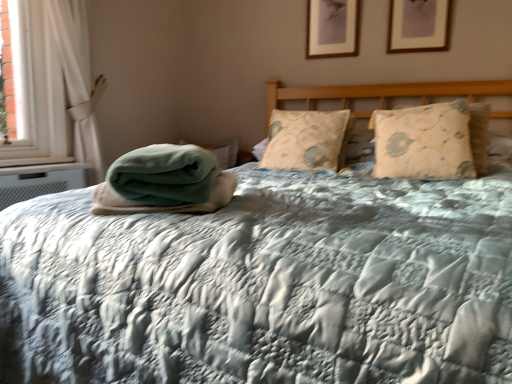
What do you see at coordinates (418, 25) in the screenshot? This screenshot has height=384, width=512. I see `wooden picture frame at upper center, arranged as the 2th picture frame when viewed from the left` at bounding box center [418, 25].

This screenshot has height=384, width=512. Describe the element at coordinates (332, 28) in the screenshot. I see `matte wooden picture frame at upper center, the first picture frame in the back-to-front sequence` at that location.

Image resolution: width=512 pixels, height=384 pixels. What do you see at coordinates (306, 140) in the screenshot?
I see `beige floral pillow at center, which ranks as the first pillow in left-to-right order` at bounding box center [306, 140].

What is the approximate height of beige floral pillow at center, the second pillow from the right?

The height of beige floral pillow at center, the second pillow from the right, is 14.52 inches.

Find the location of a particular element. The image size is (512, 384). wooden picture frame at upper center, arranged as the 2th picture frame when viewed from the left is located at coordinates (418, 25).

Is beige quilted pillow at right, placed as the second pillow when sorted from left to right, positioned with its back to white fabric curtain at left?

No, white fabric curtain at left is not at the back of beige quilted pillow at right, placed as the second pillow when sorted from left to right.

Is beige quilted pillow at right, placed as the second pillow when sorted from left to right, wider than white fabric curtain at left?

Indeed, beige quilted pillow at right, placed as the second pillow when sorted from left to right, has a greater width compared to white fabric curtain at left.

Does point (456, 168) appear closer or farther from the camera than point (89, 121)?

Point (456, 168) appears to be closer to the viewer than point (89, 121).

From the image's perspective, is beige quilted pillow at right, the first pillow positioned from the right, located beneath white fabric curtain at left?

Yes.

Is beige floral pillow at center, which ranks as the first pillow in left-to-right order, far away from white fabric curtain at left?

Yes, beige floral pillow at center, which ranks as the first pillow in left-to-right order, and white fabric curtain at left are quite far apart.

From a real-world perspective, which object rests below the other?

beige floral pillow at center, which ranks as the first pillow in left-to-right order.

Is wooden picture frame at upper center, which is the 2th picture frame from back to front, closer to the viewer compared to matte wooden picture frame at upper center, which is the 1th picture frame from left to right?

Yes, it is.

From the image's perspective, is wooden picture frame at upper center, which is the 2th picture frame from back to front, over matte wooden picture frame at upper center, which is the 2th picture frame from front to back?

No, from the image's perspective, wooden picture frame at upper center, which is the 2th picture frame from back to front, is not over matte wooden picture frame at upper center, which is the 2th picture frame from front to back.

From the picture: Can we say wooden picture frame at upper center, which is the 2th picture frame from back to front, lies outside matte wooden picture frame at upper center, which is the 2th picture frame from front to back?

wooden picture frame at upper center, which is the 2th picture frame from back to front, is positioned outside matte wooden picture frame at upper center, which is the 2th picture frame from front to back.

Are wooden picture frame at upper center, arranged as the 2th picture frame when viewed from the left, and matte wooden picture frame at upper center, which is the 1th picture frame from left to right, beside each other?

No, wooden picture frame at upper center, arranged as the 2th picture frame when viewed from the left, is not beside matte wooden picture frame at upper center, which is the 1th picture frame from left to right.

Which is behind, white fabric curtain at left or wooden picture frame at upper center, arranged as the 2th picture frame when viewed from the left?

wooden picture frame at upper center, arranged as the 2th picture frame when viewed from the left, is more distant.

In the scene shown: Choose the correct answer: Is white fabric curtain at left inside wooden picture frame at upper center, the 1th picture frame positioned from the right, or outside it?

white fabric curtain at left is outside wooden picture frame at upper center, the 1th picture frame positioned from the right.

From a real-world perspective, is white fabric curtain at left positioned above or below wooden picture frame at upper center, the 1th picture frame positioned from the right?

Clearly, from a real-world perspective, white fabric curtain at left is below wooden picture frame at upper center, the 1th picture frame positioned from the right.

Considering the sizes of objects white fabric curtain at left and wooden picture frame at upper center, the 1th picture frame positioned from the right, in the image provided, who is shorter, white fabric curtain at left or wooden picture frame at upper center, the 1th picture frame positioned from the right,?

Standing shorter between the two is wooden picture frame at upper center, the 1th picture frame positioned from the right.

Considering the sizes of objects beige quilted pillow at right, the first pillow positioned from the right, and beige floral pillow at center, which ranks as the first pillow in left-to-right order, in the image provided, who is smaller, beige quilted pillow at right, the first pillow positioned from the right, or beige floral pillow at center, which ranks as the first pillow in left-to-right order,?

Smaller between the two is beige quilted pillow at right, the first pillow positioned from the right.

From the image's perspective, is beige quilted pillow at right, placed as the second pillow when sorted from left to right, positioned above or below beige floral pillow at center, which ranks as the first pillow in left-to-right order?

beige quilted pillow at right, placed as the second pillow when sorted from left to right, is below beige floral pillow at center, which ranks as the first pillow in left-to-right order.

What's the angular difference between beige quilted pillow at right, placed as the second pillow when sorted from left to right, and beige floral pillow at center, which ranks as the first pillow in left-to-right order,'s facing directions?

beige quilted pillow at right, placed as the second pillow when sorted from left to right, and beige floral pillow at center, which ranks as the first pillow in left-to-right order, are facing 7.04 degrees away from each other.

Where is `pillow above the beige floral pillow at center, the second pillow from the right (from a real-world perspective)`? The image size is (512, 384). pillow above the beige floral pillow at center, the second pillow from the right (from a real-world perspective) is located at coordinates (431, 141).

Does point (433, 50) appear closer or farther from the camera than point (344, 127)?

Clearly, point (433, 50) is more distant from the camera than point (344, 127).

How different are the orientations of wooden picture frame at upper center, marked as the 1th picture frame in a front-to-back arrangement, and beige floral pillow at center, the second pillow from the right, in degrees?

There is a 0.451-degree angle between the facing directions of wooden picture frame at upper center, marked as the 1th picture frame in a front-to-back arrangement, and beige floral pillow at center, the second pillow from the right.

Does wooden picture frame at upper center, which is the 2th picture frame from back to front, come in front of beige floral pillow at center, which ranks as the first pillow in left-to-right order?

No.

From the image's perspective, does wooden picture frame at upper center, marked as the 1th picture frame in a front-to-back arrangement, appear lower than beige floral pillow at center, which ranks as the first pillow in left-to-right order?

Incorrect, from the image's perspective, wooden picture frame at upper center, marked as the 1th picture frame in a front-to-back arrangement, is higher than beige floral pillow at center, which ranks as the first pillow in left-to-right order.

Can you tell me how much white fabric curtain at left and beige quilted pillow at right, placed as the second pillow when sorted from left to right, differ in facing direction?

There is a 97.3-degree angle between the facing directions of white fabric curtain at left and beige quilted pillow at right, placed as the second pillow when sorted from left to right.

Based on the photo, which of these two, white fabric curtain at left or beige quilted pillow at right, placed as the second pillow when sorted from left to right, is wider?

With larger width is beige quilted pillow at right, placed as the second pillow when sorted from left to right.

Is point (32, 6) closer or farther from the camera than point (375, 168)?

Point (32, 6) is positioned farther from the camera compared to point (375, 168).

Find the location of a particular element. curtain behind the beige quilted pillow at right, placed as the second pillow when sorted from left to right is located at coordinates (52, 86).

The image size is (512, 384). In order to click on curtain that appears on the left of beige floral pillow at center, which ranks as the first pillow in left-to-right order in this screenshot , I will do `click(52, 86)`.

Based on the photo, based on their spatial positions, is green textured blanket at center or matte wooden picture frame at upper center, which is the 1th picture frame from left to right, closer to wooden picture frame at upper center, which is the 2th picture frame from back to front?

Among the two, matte wooden picture frame at upper center, which is the 1th picture frame from left to right, is located nearer to wooden picture frame at upper center, which is the 2th picture frame from back to front.

When comparing their distances from wooden picture frame at upper center, the 1th picture frame positioned from the right, does beige floral pillow at center, which ranks as the first pillow in left-to-right order, or beige quilted pillow at right, the first pillow positioned from the right, seem closer?

The object closer to wooden picture frame at upper center, the 1th picture frame positioned from the right, is beige quilted pillow at right, the first pillow positioned from the right.

In the scene shown: Looking at the image, which one is located closer to beige floral pillow at center, which ranks as the first pillow in left-to-right order, wooden picture frame at upper center, arranged as the 2th picture frame when viewed from the left, or white fabric curtain at left?

The object closer to beige floral pillow at center, which ranks as the first pillow in left-to-right order, is wooden picture frame at upper center, arranged as the 2th picture frame when viewed from the left.

Looking at the image, which one is located closer to wooden picture frame at upper center, the 1th picture frame positioned from the right, beige quilted pillow at right, placed as the second pillow when sorted from left to right, or matte wooden picture frame at upper center, the first picture frame in the back-to-front sequence?

The object closer to wooden picture frame at upper center, the 1th picture frame positioned from the right, is matte wooden picture frame at upper center, the first picture frame in the back-to-front sequence.

Estimate the real-world distances between objects in this image. Which object is closer to green textured blanket at center, matte wooden picture frame at upper center, which is the 2th picture frame from front to back, or white fabric curtain at left?

white fabric curtain at left is closer to green textured blanket at center.

Based on their spatial positions, is matte wooden picture frame at upper center, which is the 1th picture frame from left to right, or green textured blanket at center further from beige floral pillow at center, the second pillow from the right?

green textured blanket at center is further to beige floral pillow at center, the second pillow from the right.

When comparing their distances from wooden picture frame at upper center, the 1th picture frame positioned from the right, does white fabric curtain at left or beige quilted pillow at right, the first pillow positioned from the right, seem closer?

beige quilted pillow at right, the first pillow positioned from the right, is closer to wooden picture frame at upper center, the 1th picture frame positioned from the right.

From the picture: Which object lies further to the anchor point beige floral pillow at center, the second pillow from the right, matte wooden picture frame at upper center, which is the 2th picture frame from front to back, or beige quilted pillow at right, placed as the second pillow when sorted from left to right?

matte wooden picture frame at upper center, which is the 2th picture frame from front to back, is further to beige floral pillow at center, the second pillow from the right.

Find the location of a particular element. picture frame between matte wooden picture frame at upper center, the first picture frame in the back-to-front sequence, and beige floral pillow at center, the second pillow from the right, from top to bottom is located at coordinates pyautogui.click(x=418, y=25).

Find the location of a particular element. Image resolution: width=512 pixels, height=384 pixels. material between white fabric curtain at left and beige floral pillow at center, which ranks as the first pillow in left-to-right order is located at coordinates (164, 175).

Locate an element on the screen. material between white fabric curtain at left and beige quilted pillow at right, placed as the second pillow when sorted from left to right is located at coordinates (164, 175).

This screenshot has height=384, width=512. I want to click on pillow located between green textured blanket at center and beige floral pillow at center, which ranks as the first pillow in left-to-right order, in the depth direction, so click(x=431, y=141).